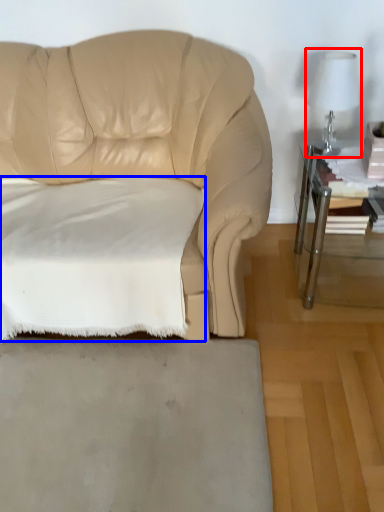
Question: Among these objects, which one is nearest to the camera, table lamp (highlighted by a red box) or pillow (highlighted by a blue box)?

Choices:
 (A) table lamp
 (B) pillow

Answer: (B)